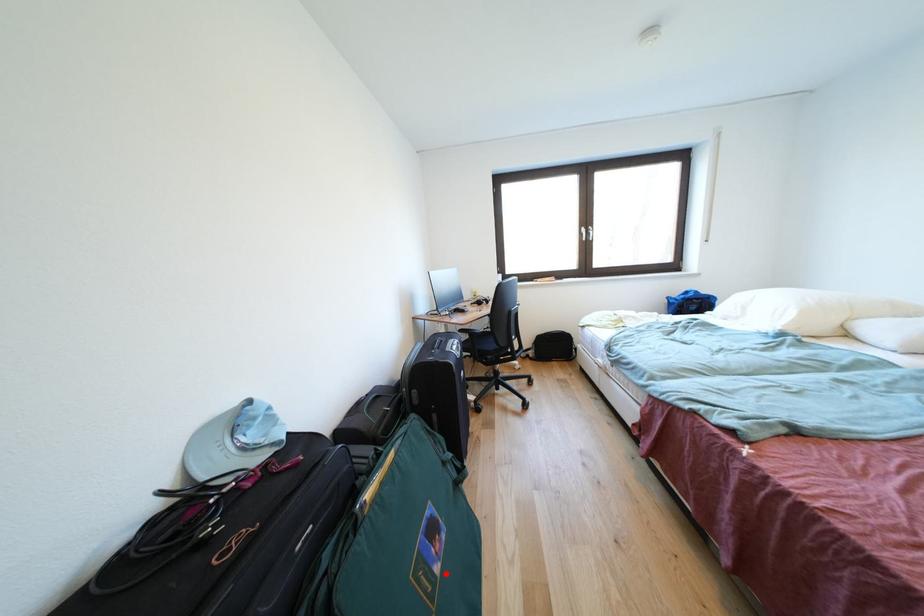
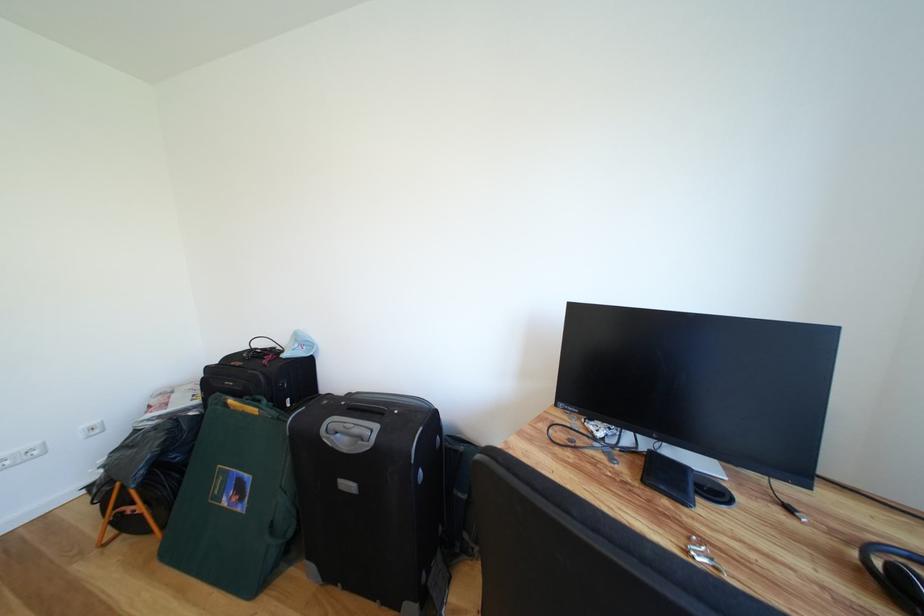
Where in the second image is the point corresponding to the highlighted location from the first image?

(234, 506)